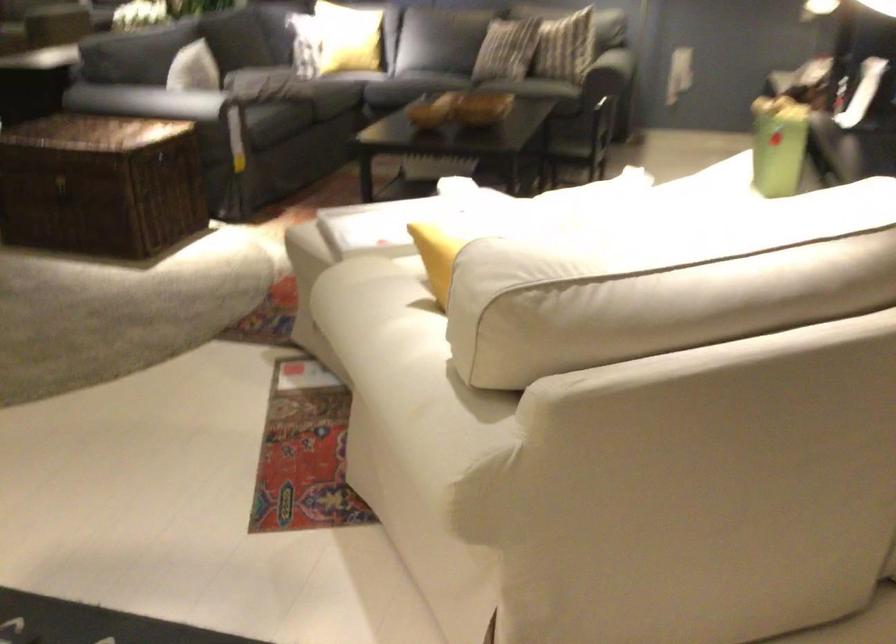
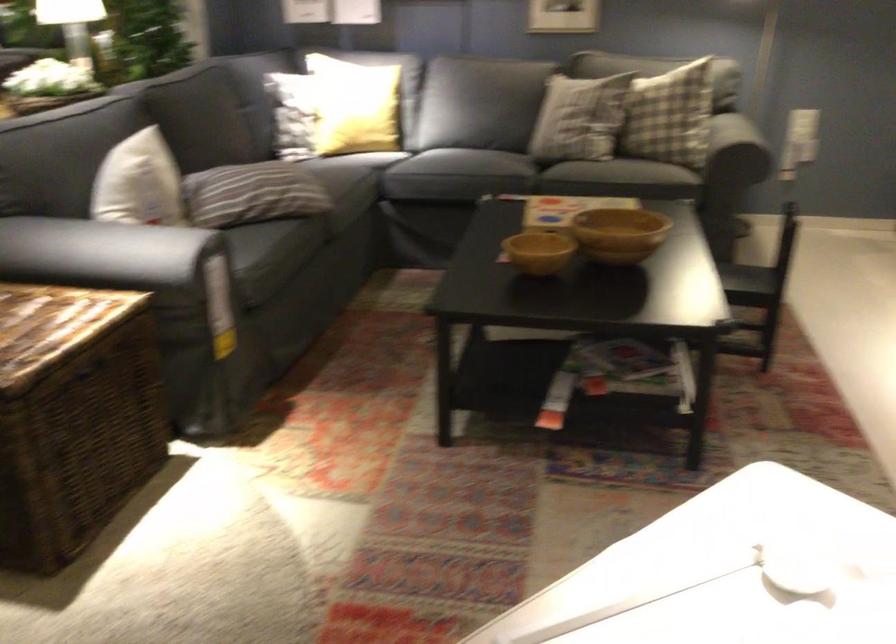
Where in the second image is the point corresponding to the point at 488,106 from the first image?

(618, 234)